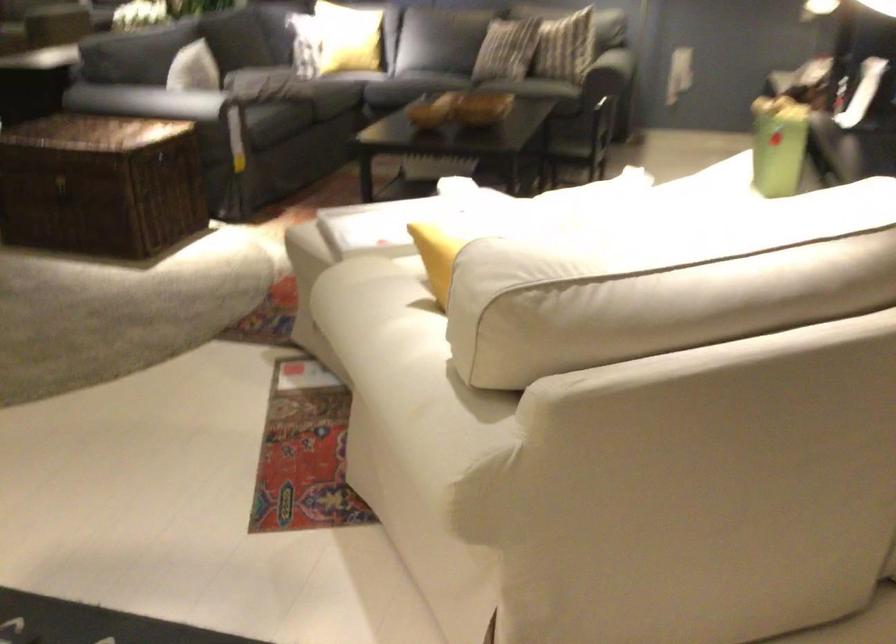
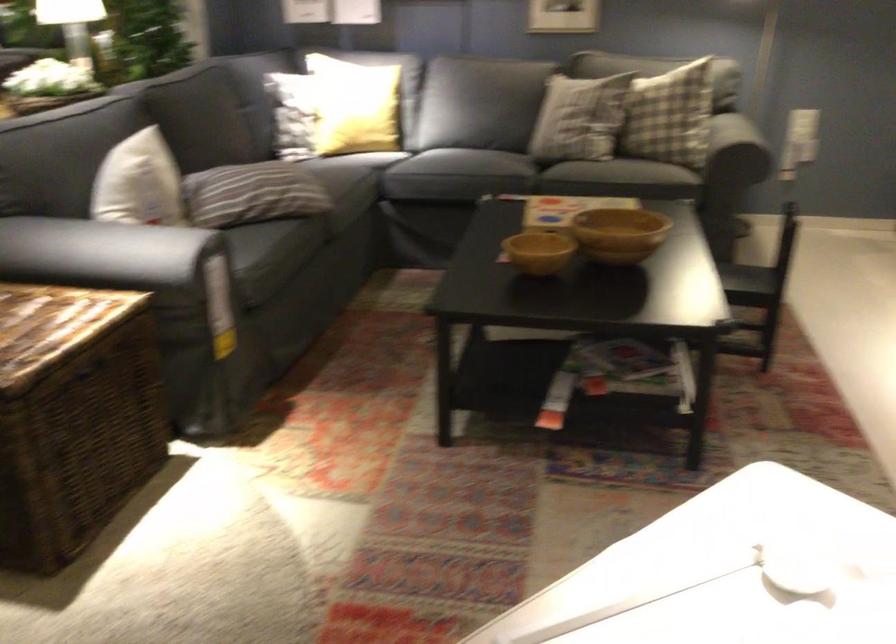
Where in the second image is the point corresponding to the point at 488,106 from the first image?

(618, 234)